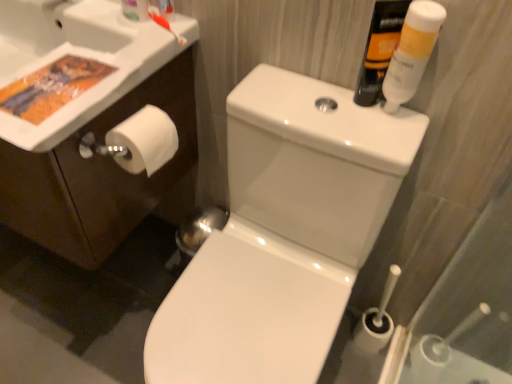
Question: Is white glossy sink at upper left shorter than white matte toilet paper at left?

Choices:
 (A) yes
 (B) no

Answer: (B)

Question: Is the position of white glossy sink at upper left more distant than that of white matte toilet paper at left?

Choices:
 (A) yes
 (B) no

Answer: (B)

Question: Is white glossy sink at upper left outside white matte toilet paper at left?

Choices:
 (A) no
 (B) yes

Answer: (B)

Question: Does white glossy sink at upper left have a lesser width compared to white matte toilet paper at left?

Choices:
 (A) no
 (B) yes

Answer: (A)

Question: From a real-world perspective, is white glossy sink at upper left positioned under white matte toilet paper at left based on gravity?

Choices:
 (A) yes
 (B) no

Answer: (B)

Question: Is orange plastic toothbrush at upper left situated inside white glossy toilet at center or outside?

Choices:
 (A) inside
 (B) outside

Answer: (B)

Question: Is orange plastic toothbrush at upper left wider or thinner than white glossy toilet at center?

Choices:
 (A) thin
 (B) wide

Answer: (A)

Question: From a real-world perspective, is orange plastic toothbrush at upper left positioned above or below white glossy toilet at center?

Choices:
 (A) above
 (B) below

Answer: (A)

Question: In terms of size, does orange plastic toothbrush at upper left appear bigger or smaller than white glossy toilet at center?

Choices:
 (A) small
 (B) big

Answer: (A)

Question: Is translucent plastic toothbrush at upper left taller or shorter than translucent plastic mouthwash at upper right, the second mouthwash when ordered from right to left?

Choices:
 (A) tall
 (B) short

Answer: (B)

Question: Relative to translucent plastic mouthwash at upper right, the first mouthwash viewed from the left, is translucent plastic toothbrush at upper left in front or behind?

Choices:
 (A) behind
 (B) front

Answer: (A)

Question: Is translucent plastic toothbrush at upper left to the left or to the right of translucent plastic mouthwash at upper right, the first mouthwash viewed from the left, in the image?

Choices:
 (A) left
 (B) right

Answer: (A)

Question: From a real-world perspective, is translucent plastic toothbrush at upper left above or below translucent plastic mouthwash at upper right, the second mouthwash when ordered from right to left?

Choices:
 (A) below
 (B) above

Answer: (B)

Question: From a real-world perspective, is translucent plastic mouthwash at upper right, the second mouthwash when ordered from right to left, physically located above or below orange plastic toothbrush at upper left?

Choices:
 (A) above
 (B) below

Answer: (A)

Question: From their relative heights in the image, would you say translucent plastic mouthwash at upper right, the second mouthwash when ordered from right to left, is taller or shorter than orange plastic toothbrush at upper left?

Choices:
 (A) tall
 (B) short

Answer: (A)